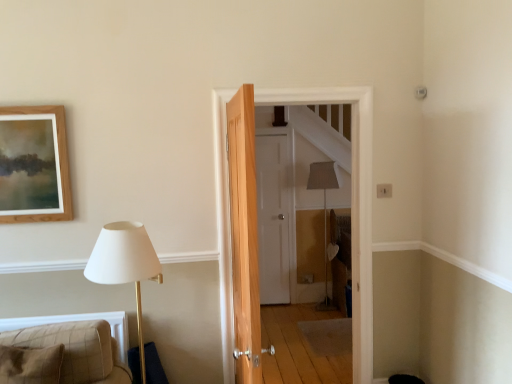
This screenshot has height=384, width=512. What are the coordinates of `plaid fabric cushion at lower left` in the screenshot? It's located at (80, 349).

I want to click on white matte door at center, which appears as the 1th door when viewed from the back, so (273, 217).

From the image's perspective, which door is the 2nd one above the plaid fabric cushion at lower left? Please provide its 2D coordinates.

[(352, 204)]

Does wooden door at center, which is the second door from back to front, touch plaid fabric cushion at lower left?

No, wooden door at center, which is the second door from back to front, is not with plaid fabric cushion at lower left.

Consider the image. Is wooden door at center, which is the second door from back to front, wider than plaid fabric cushion at lower left?

No.

Which of these two, white matte door at center, which appears as the 1th door when viewed from the back, or plaid fabric cushion at lower left, stands taller?

Standing taller between the two is white matte door at center, which appears as the 1th door when viewed from the back.

Considering the relative sizes of white matte door at center, which appears as the 1th door when viewed from the back, and plaid fabric cushion at lower left in the image provided, is white matte door at center, which appears as the 1th door when viewed from the back, wider than plaid fabric cushion at lower left?

In fact, white matte door at center, which appears as the 1th door when viewed from the back, might be narrower than plaid fabric cushion at lower left.

Which of these two, plaid fabric cushion at lower left or wooden door at center, which is the second door from back to front, is bigger?

With larger size is wooden door at center, which is the second door from back to front.

Considering the relative sizes of plaid fabric cushion at lower left and wooden door at center, which is the second door from back to front, in the image provided, is plaid fabric cushion at lower left wider than wooden door at center, which is the second door from back to front,?

Indeed, plaid fabric cushion at lower left has a greater width compared to wooden door at center, which is the second door from back to front.

Is plaid fabric cushion at lower left directly adjacent to wooden door at center, placed as the 1th door when sorted from front to back?

plaid fabric cushion at lower left is not next to wooden door at center, placed as the 1th door when sorted from front to back, and they're not touching.

From the image's perspective, would you say plaid fabric cushion at lower left is shown under wooden door at center, which is the second door from back to front?

Indeed, from the image's perspective, plaid fabric cushion at lower left is shown beneath wooden door at center, which is the second door from back to front.

Based on the photo, from a real-world perspective, relative to white matte door at center, which appears as the 1th door when viewed from the back, is plaid fabric cushion at lower left vertically above or below?

In terms of real-world spatial position, plaid fabric cushion at lower left is below white matte door at center, which appears as the 1th door when viewed from the back.

Looking at their sizes, would you say plaid fabric cushion at lower left is wider or thinner than white matte door at center, which is the second door in front-to-back order?

plaid fabric cushion at lower left is wider than white matte door at center, which is the second door in front-to-back order.

Does plaid fabric cushion at lower left come behind white matte door at center, which appears as the 1th door when viewed from the back?

No, plaid fabric cushion at lower left is closer to the camera.

Which is correct: plaid fabric cushion at lower left is inside white matte door at center, which appears as the 1th door when viewed from the back, or outside of it?

plaid fabric cushion at lower left lies outside white matte door at center, which appears as the 1th door when viewed from the back.

Is wooden door at center, which is the second door from back to front, thinner than white matte door at center, which is the second door in front-to-back order?

Incorrect, the width of wooden door at center, which is the second door from back to front, is not less than that of white matte door at center, which is the second door in front-to-back order.

Which is behind, point (356, 166) or point (266, 278)?

The point (266, 278) is farther.

Is wooden door at center, placed as the 1th door when sorted from front to back, not close to white matte door at center, which appears as the 1th door when viewed from the back?

Indeed, wooden door at center, placed as the 1th door when sorted from front to back, is not near white matte door at center, which appears as the 1th door when viewed from the back.

Considering their positions, is wooden door at center, placed as the 1th door when sorted from front to back, located in front of or behind white matte door at center, which is the second door in front-to-back order?

Visually, wooden door at center, placed as the 1th door when sorted from front to back, is located in front of white matte door at center, which is the second door in front-to-back order.

Considering the positions of point (259, 276) and point (364, 101), is point (259, 276) closer or farther from the camera than point (364, 101)?

Point (259, 276) is positioned farther from the camera compared to point (364, 101).

From the image's perspective, which one is positioned lower, white matte door at center, which is the second door in front-to-back order, or wooden door at center, placed as the 1th door when sorted from front to back?

white matte door at center, which is the second door in front-to-back order, appears lower in the image.

Considering the positions of objects white matte door at center, which is the second door in front-to-back order, and wooden door at center, placed as the 1th door when sorted from front to back, in the image provided, who is more to the right, white matte door at center, which is the second door in front-to-back order, or wooden door at center, placed as the 1th door when sorted from front to back,?

wooden door at center, placed as the 1th door when sorted from front to back.

Image resolution: width=512 pixels, height=384 pixels. I want to click on door that is the 2nd one when counting upward from the plaid fabric cushion at lower left (from the image's perspective), so click(x=352, y=204).

This screenshot has width=512, height=384. Identify the location of furniture lying in front of the white matte door at center, which is the second door in front-to-back order. (80, 349).

Which object lies further to the anchor point white matte door at center, which is the second door in front-to-back order, wooden door at center, placed as the 1th door when sorted from front to back, or plaid fabric cushion at lower left?

plaid fabric cushion at lower left is further to white matte door at center, which is the second door in front-to-back order.

Estimate the real-world distances between objects in this image. Which object is further from plaid fabric cushion at lower left, white matte door at center, which is the second door in front-to-back order, or wooden door at center, placed as the 1th door when sorted from front to back?

white matte door at center, which is the second door in front-to-back order, lies further to plaid fabric cushion at lower left than the other object.

Looking at the image, which one is located further to wooden door at center, placed as the 1th door when sorted from front to back, white matte door at center, which is the second door in front-to-back order, or plaid fabric cushion at lower left?

white matte door at center, which is the second door in front-to-back order, is further to wooden door at center, placed as the 1th door when sorted from front to back.

Looking at the image, which one is located closer to plaid fabric cushion at lower left, wooden door at center, which is the second door from back to front, or white matte door at center, which is the second door in front-to-back order?

wooden door at center, which is the second door from back to front, lies closer to plaid fabric cushion at lower left than the other object.

Looking at the image, which one is located closer to white matte door at center, which is the second door in front-to-back order, plaid fabric cushion at lower left or wooden door at center, placed as the 1th door when sorted from front to back?

wooden door at center, placed as the 1th door when sorted from front to back, is positioned closer to the anchor white matte door at center, which is the second door in front-to-back order.

Considering their positions, is plaid fabric cushion at lower left positioned further to wooden door at center, which is the second door from back to front, than white matte door at center, which appears as the 1th door when viewed from the back?

white matte door at center, which appears as the 1th door when viewed from the back, lies further to wooden door at center, which is the second door from back to front, than the other object.

You are a GUI agent. You are given a task and a screenshot of the screen. Output one action in this format:
    pyautogui.click(x=<x>, y=<y>)
    Task: Click on the door between plaid fabric cushion at lower left and white matte door at center, which is the second door in front-to-back order, from front to back
    This screenshot has width=512, height=384.
    Given the screenshot: What is the action you would take?
    pyautogui.click(x=352, y=204)